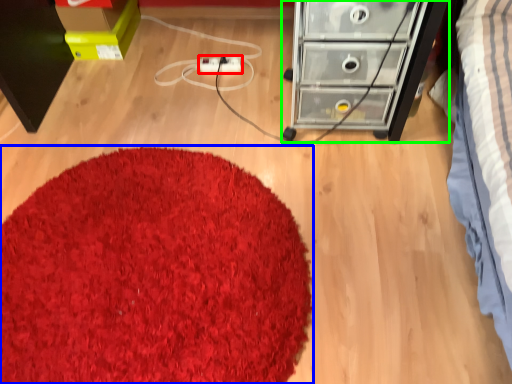
Question: Based on their relative distances, which object is nearer to extension cord (highlighted by a red box)? Choose from mat (highlighted by a blue box) and chest of drawers (highlighted by a green box).

Choices:
 (A) mat
 (B) chest of drawers

Answer: (B)